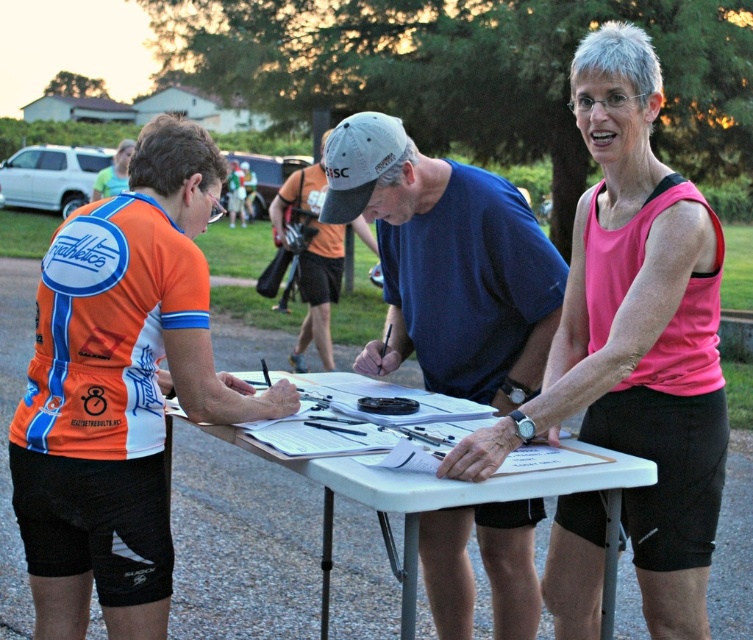
Question: Is the position of blue cotton t-shirt at center less distant than that of orange mesh shirt at center?

Choices:
 (A) yes
 (B) no

Answer: (A)

Question: Which of the following is the farthest from the observer?

Choices:
 (A) blue cotton t-shirt at center
 (B) orange mesh shirt at center
 (C) orange jersey at left

Answer: (B)

Question: Can you confirm if orange jersey at left is bigger than white plastic table at center?

Choices:
 (A) yes
 (B) no

Answer: (B)

Question: Which point appears farthest from the camera in this image?

Choices:
 (A) (492, 595)
 (B) (639, 275)
 (C) (358, 445)

Answer: (A)

Question: Does pink fabric tank top at center come in front of white plastic table at center?

Choices:
 (A) yes
 (B) no

Answer: (B)

Question: Estimate the real-world distances between objects in this image. Which object is closer to the orange mesh shirt at center?

Choices:
 (A) orange jersey at left
 (B) blue cotton t-shirt at center
 (C) pink fabric tank top at center
 (D) white plastic table at center

Answer: (B)